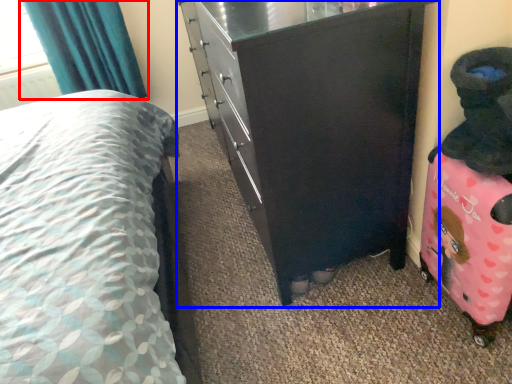
Question: Which of the following is the farthest to the observer, curtain (highlighted by a red box) or chest of drawers (highlighted by a blue box)?

Choices:
 (A) curtain
 (B) chest of drawers

Answer: (A)